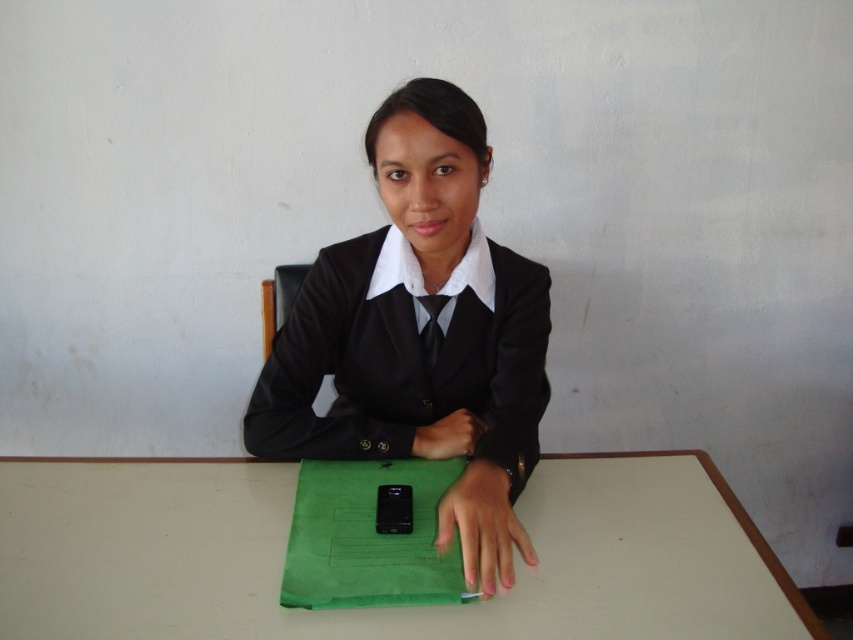
Can you confirm if white matte table at center is thinner than black matte uniform at center?

Incorrect, white matte table at center's width is not less than black matte uniform at center's.

Image resolution: width=853 pixels, height=640 pixels. Find the location of `white matte table at center`. white matte table at center is located at coordinates (381, 609).

This screenshot has width=853, height=640. Find the location of `white matte table at center`. white matte table at center is located at coordinates (381, 609).

Is white matte table at center bigger than matte black hand at center?

Indeed, white matte table at center has a larger size compared to matte black hand at center.

Does white matte table at center appear over matte black hand at center?

Incorrect, white matte table at center is not positioned above matte black hand at center.

Looking at this image, who is more forward, (718, 563) or (450, 417)?

Positioned in front is point (718, 563).

Image resolution: width=853 pixels, height=640 pixels. I want to click on white matte table at center, so click(x=381, y=609).

In the scene shown: Who is taller, black matte uniform at center or matte black hand at center?

With more height is black matte uniform at center.

Based on the photo, does black matte uniform at center have a greater width compared to matte black hand at center?

Yes.

Describe the element at coordinates (419, 330) in the screenshot. This screenshot has height=640, width=853. I see `black matte uniform at center` at that location.

You are a GUI agent. You are given a task and a screenshot of the screen. Output one action in this format:
    pyautogui.click(x=<x>, y=<y>)
    Task: Click on the black matte uniform at center
    
    Given the screenshot: What is the action you would take?
    pyautogui.click(x=419, y=330)